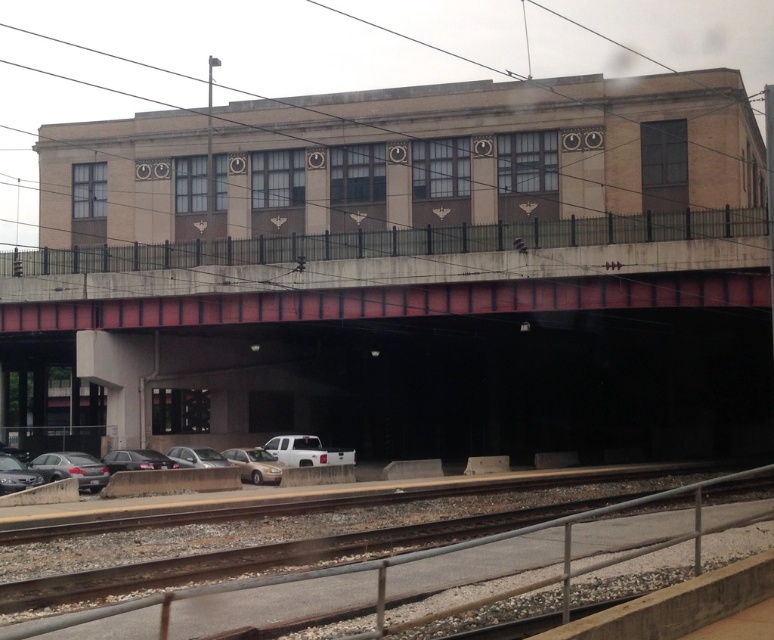
Question: Which object appears closest to the camera in this image?

Choices:
 (A) shiny silver sedan at lower left
 (B) concrete bridge at center
 (C) satin gold sedan at lower center
 (D) white matte truck at lower center

Answer: (A)

Question: Which object is the farthest from the beige concrete building at upper center?

Choices:
 (A) silver metallic truck at lower center
 (B) shiny black sedan at lower left

Answer: (B)

Question: Does silver metallic truck at lower center have a greater width compared to shiny silver sedan at lower left?

Choices:
 (A) yes
 (B) no

Answer: (A)

Question: Which point appears closest to the camera in this image?

Choices:
 (A) (259, 474)
 (B) (55, 476)

Answer: (B)

Question: Is silver metallic truck at lower center to the right of white matte truck at lower center from the viewer's perspective?

Choices:
 (A) yes
 (B) no

Answer: (B)

Question: Is concrete bridge at center thinner than silver metallic truck at lower center?

Choices:
 (A) no
 (B) yes

Answer: (A)